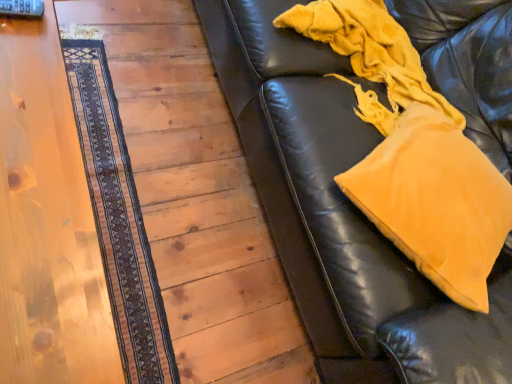
Question: Considering the positions of mustard yellow fabric pillow at upper right and velvety yellow blanket at right in the image, is mustard yellow fabric pillow at upper right taller or shorter than velvety yellow blanket at right?

Choices:
 (A) short
 (B) tall

Answer: (A)

Question: From the image's perspective, is mustard yellow fabric pillow at upper right located above or below velvety yellow blanket at right?

Choices:
 (A) above
 (B) below

Answer: (B)

Question: Which object is positioned closest to the wooden floor at lower left?

Choices:
 (A) wooden table at left
 (B) mustard yellow fabric pillow at upper right
 (C) velvety yellow blanket at right
 (D) dark brown woven mat at left

Answer: (D)

Question: Estimate the real-world distances between objects in this image. Which object is farther from the velvety yellow blanket at right?

Choices:
 (A) wooden table at left
 (B) dark brown woven mat at left
 (C) mustard yellow fabric pillow at upper right
 (D) wooden floor at lower left

Answer: (A)